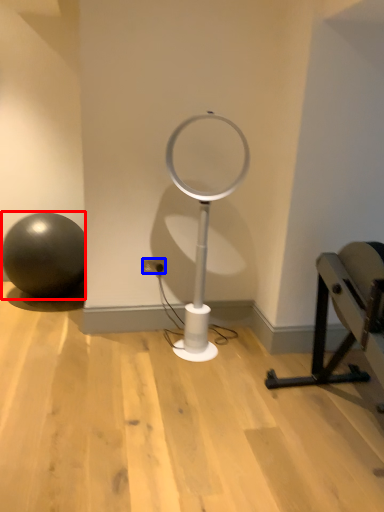
Question: Which point is further to the camera, ball (highlighted by a red box) or electric outlet (highlighted by a blue box)?

Choices:
 (A) ball
 (B) electric outlet

Answer: (A)